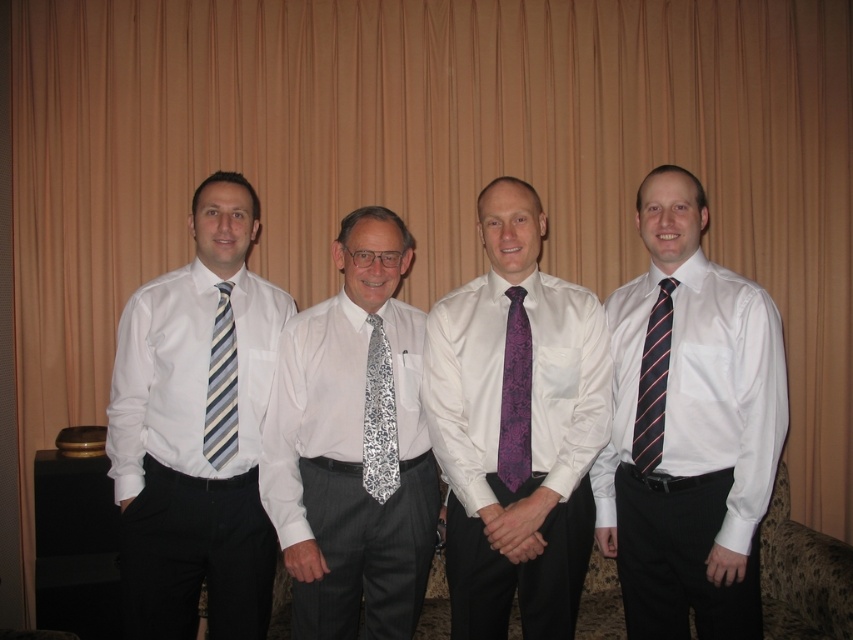
From the picture: Is matte striped tie at left bigger than purple floral tie at center?

Yes.

What do you see at coordinates (196, 429) in the screenshot?
I see `matte striped tie at left` at bounding box center [196, 429].

Where is `matte striped tie at left`? The width and height of the screenshot is (853, 640). matte striped tie at left is located at coordinates (196, 429).

Which is below, striped fabric tie at right or striped fabric tie at left?

striped fabric tie at right

Between striped fabric tie at right and striped fabric tie at left, which one appears on the right side from the viewer's perspective?

striped fabric tie at right is more to the right.

Between point (662, 353) and point (221, 300), which one is positioned behind?

Positioned behind is point (221, 300).

The image size is (853, 640). Identify the location of striped fabric tie at right. point(653,381).

Is matte striped tie at left thinner than striped fabric tie at left?

Incorrect, matte striped tie at left's width is not less than striped fabric tie at left's.

Between matte striped tie at left and striped fabric tie at left, which one appears on the right side from the viewer's perspective?

striped fabric tie at left

Is point (200, 298) in front of point (223, 378)?

No, (200, 298) is further to viewer.

Find the location of a particular element. The width and height of the screenshot is (853, 640). matte striped tie at left is located at coordinates (196, 429).